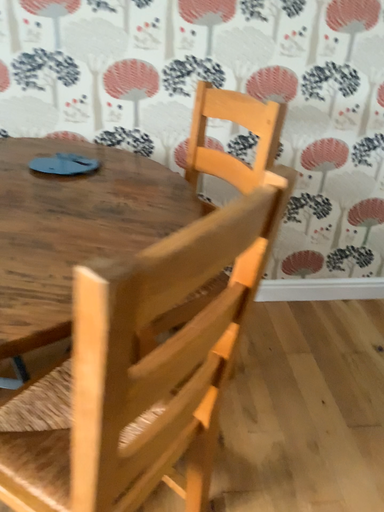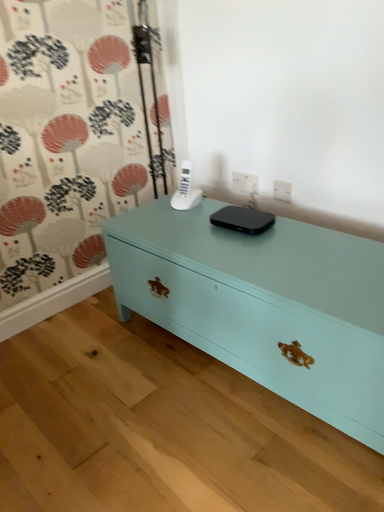
Question: Which way did the camera rotate in the video?

Choices:
 (A) rotated downward
 (B) rotated upward

Answer: (B)